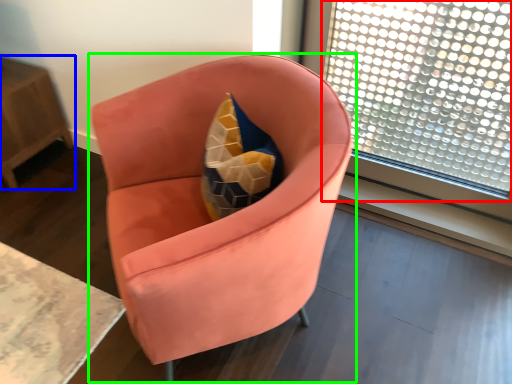
Question: Considering the real-world distances, which object is farthest from window (highlighted by a red box)? table (highlighted by a blue box) or chair (highlighted by a green box)?

Choices:
 (A) table
 (B) chair

Answer: (A)